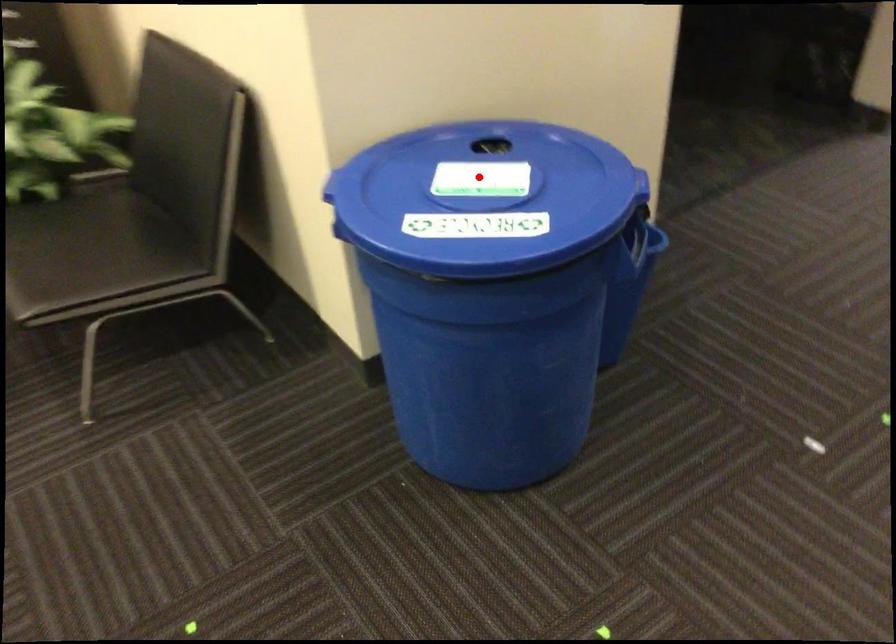
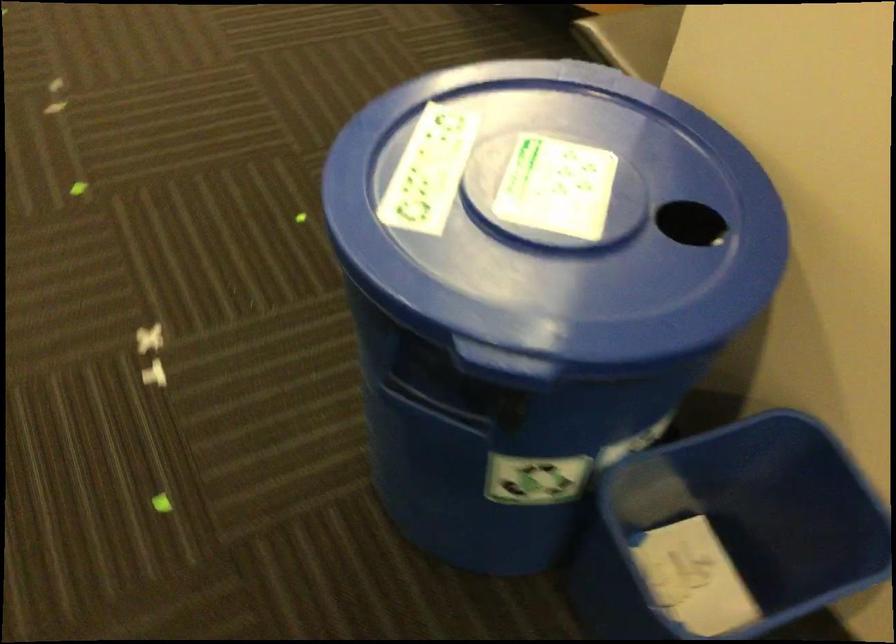
Locate, in the second image, the point that corresponds to the highlighted location in the first image.

(556, 187)